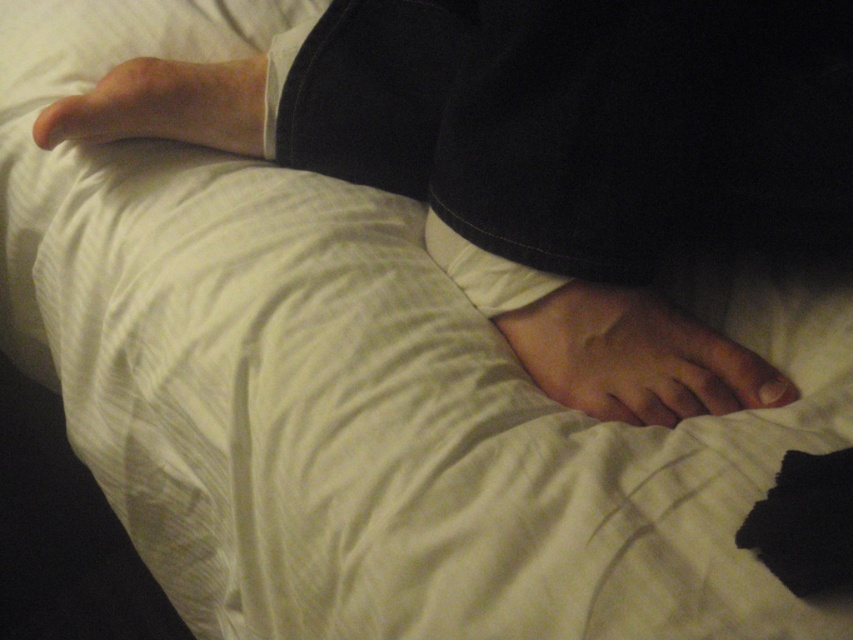
Question: Does smooth skin foot at center appear under matte skin foot at upper left?

Choices:
 (A) no
 (B) yes

Answer: (B)

Question: Which point is farther to the camera?

Choices:
 (A) smooth skin foot at center
 (B) matte skin foot at upper left

Answer: (B)

Question: Does smooth skin foot at center have a greater width compared to matte skin foot at upper left?

Choices:
 (A) yes
 (B) no

Answer: (A)

Question: Which object is closer to the camera taking this photo?

Choices:
 (A) smooth skin foot at center
 (B) matte skin foot at upper left

Answer: (A)

Question: Is smooth skin foot at center wider than matte skin foot at upper left?

Choices:
 (A) no
 (B) yes

Answer: (B)

Question: Among these objects, which one is nearest to the camera?

Choices:
 (A) matte skin foot at upper left
 (B) smooth skin foot at center

Answer: (B)